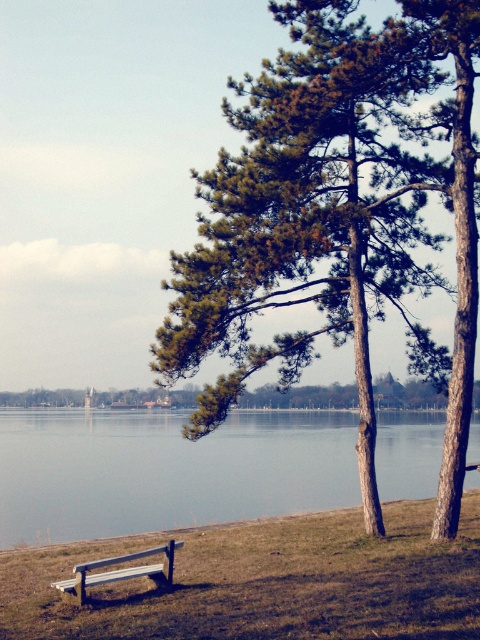
You are standing at the point labeled point (264, 582). Based on the scene description, what is the immediate terrain under your feet?

The immediate terrain under your feet at point (264, 582) is brown grassy at lower center.